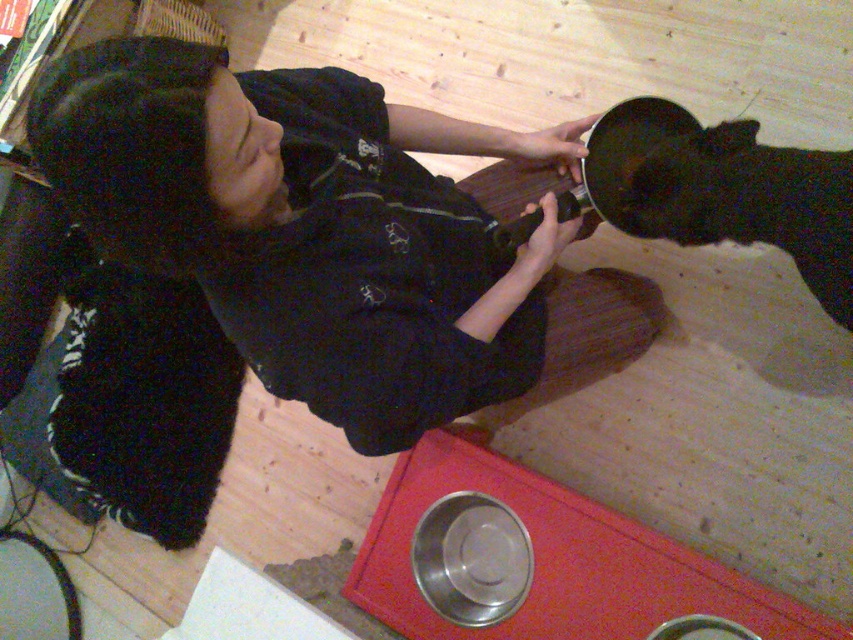
Who is lower down, black cotton shirt at upper center or black fur pet at lower right?

black cotton shirt at upper center

Consider the image. Does black cotton shirt at upper center come behind black fur pet at lower right?

No, it is in front of black fur pet at lower right.

What do you see at coordinates (308, 225) in the screenshot? The height and width of the screenshot is (640, 853). I see `black cotton shirt at upper center` at bounding box center [308, 225].

Where is `black cotton shirt at upper center`? black cotton shirt at upper center is located at coordinates (308, 225).